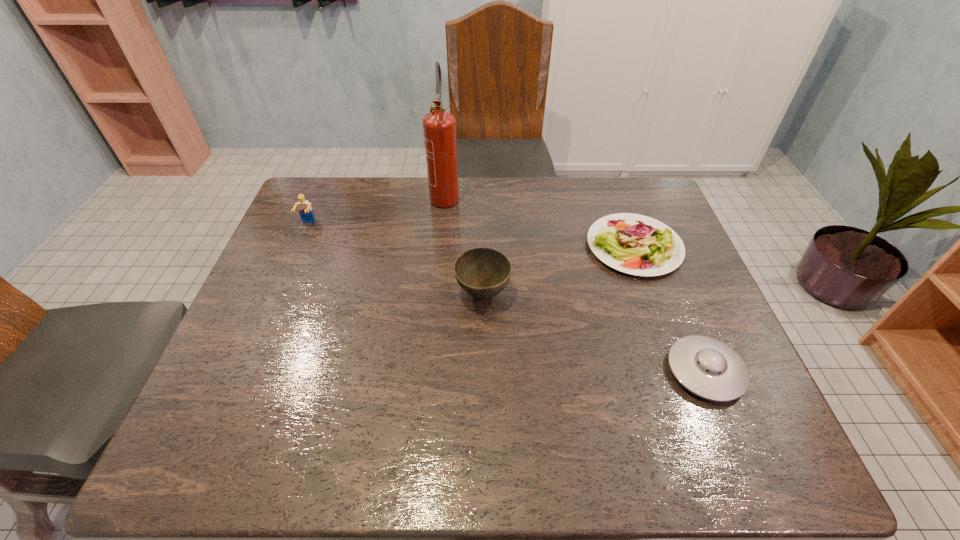
At what (x,y) coordinates should I click in order to perform the action: click on free spot between the second object from left to right and the leftmost object. Please return your answer as a coordinate pair (x, y). Looking at the image, I should click on click(376, 210).

At what (x,y) coordinates should I click in order to perform the action: click on blank region between the bowl and the saucer. Please return your answer as a coordinate pair (x, y). The width and height of the screenshot is (960, 540). Looking at the image, I should click on (594, 333).

What are the coordinates of `vacant area that lies between the saucer and the leftmost object` in the screenshot? It's located at (507, 298).

Where is `vacant area that lies between the third object from left to right and the farthest object`? The height and width of the screenshot is (540, 960). vacant area that lies between the third object from left to right and the farthest object is located at coordinates (464, 245).

Where is `free spot between the bowl and the Lego`? The height and width of the screenshot is (540, 960). free spot between the bowl and the Lego is located at coordinates (396, 259).

The width and height of the screenshot is (960, 540). Find the location of `the closest object to the second object from left to right`. the closest object to the second object from left to right is located at coordinates (483, 273).

Locate an element on the screen. Image resolution: width=960 pixels, height=540 pixels. object that is the second closest to the salad plate is located at coordinates (483, 273).

You are a GUI agent. You are given a task and a screenshot of the screen. Output one action in this format:
    pyautogui.click(x=<x>, y=<y>)
    Task: Click on the vacant position in the image that satisfies the following two spatial constraints: 1. from the nozzle of the saucer; 2. on the left side of the second object from left to right
    The image size is (960, 540).
    Given the screenshot: What is the action you would take?
    pyautogui.click(x=428, y=372)

At what (x,y) coordinates should I click in order to perform the action: click on vacant space that satisfies the following two spatial constraints: 1. on the face of the nearest object; 2. on the right side of the leftmost object. Please return your answer as a coordinate pair (x, y). The image size is (960, 540). Looking at the image, I should click on (245, 372).

At what (x,y) coordinates should I click in order to perform the action: click on free spot that satisfies the following two spatial constraints: 1. on the face of the nearest object; 2. on the right side of the Lego. Please return your answer as a coordinate pair (x, y). Looking at the image, I should click on (245, 372).